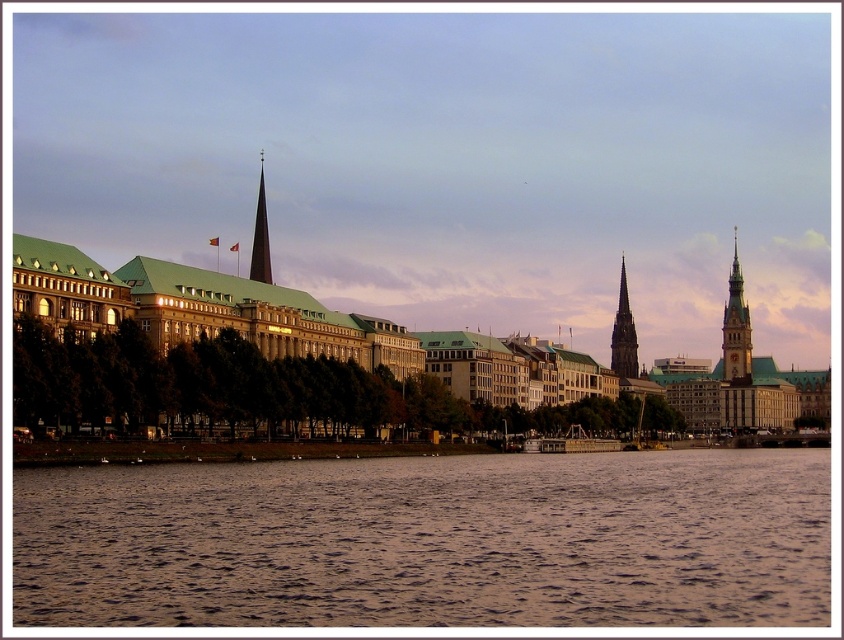
You are a photographer trying to capture the reflection of the shiny dark glass spire at center in the brown water at lower center. Based on the scene description, can you confirm if the spire will be visible in the water?

The brown water at lower center is in front of the shiny dark glass spire at center, so the spire is behind the water. Since reflections require the object to be behind the reflective surface, the spire should be visible in the water.

You are an architect analyzing the riverside scene. You notice the gold textured clock tower at right and the shiny dark glass spire at center. Which structure is taller?

The shiny dark glass spire at center is taller than the gold textured clock tower at right.